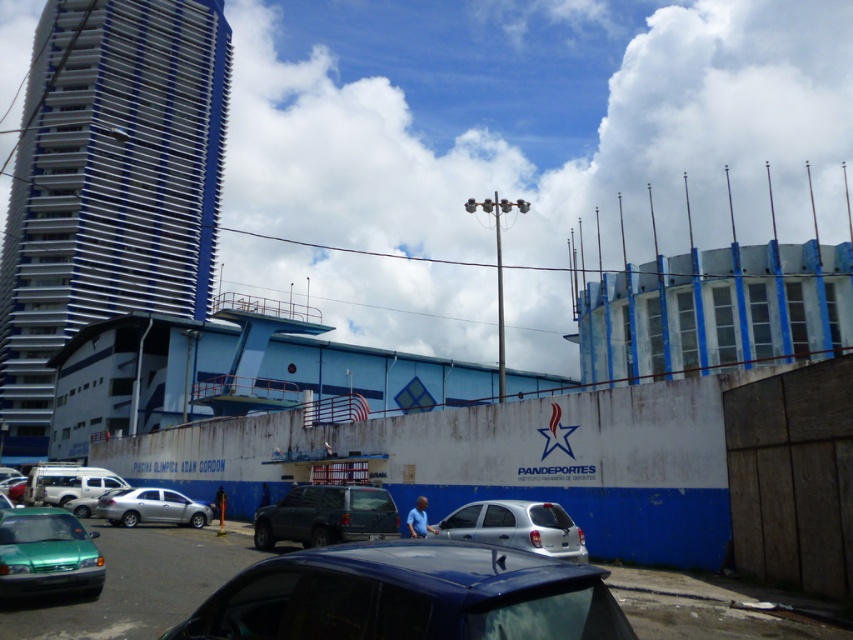
Question: Which point is closer to the camera?

Choices:
 (A) satin silver sedan at center
 (B) silver metallic car at lower left
 (C) glossy blue car at center
 (D) silver metallic car at center

Answer: (C)

Question: Is blue glass tower at left positioned in front of glossy blue car at center?

Choices:
 (A) yes
 (B) no

Answer: (B)

Question: Can you confirm if green matte car at lower left is positioned below silver metallic car at lower left?

Choices:
 (A) yes
 (B) no

Answer: (B)

Question: Can you confirm if green matte car at lower left is positioned to the left of matte black suv at center?

Choices:
 (A) no
 (B) yes

Answer: (B)

Question: Which of the following is the closest to the observer?

Choices:
 (A) matte black suv at center
 (B) blue glass tower at left

Answer: (A)

Question: Among these points, which one is nearest to the camera?

Choices:
 (A) (383, 556)
 (B) (299, 500)
 (C) (65, 568)

Answer: (A)